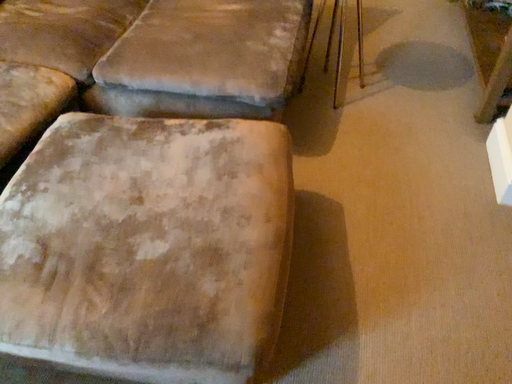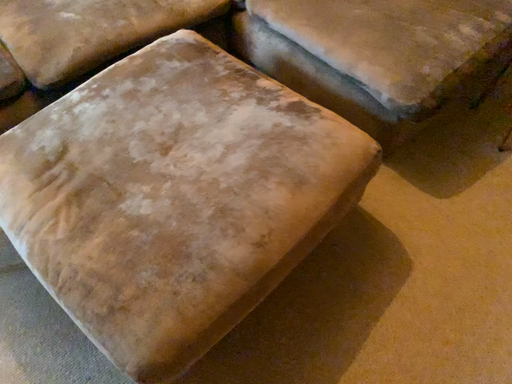
Question: Which way did the camera rotate in the video?

Choices:
 (A) rotated left
 (B) rotated right

Answer: (A)